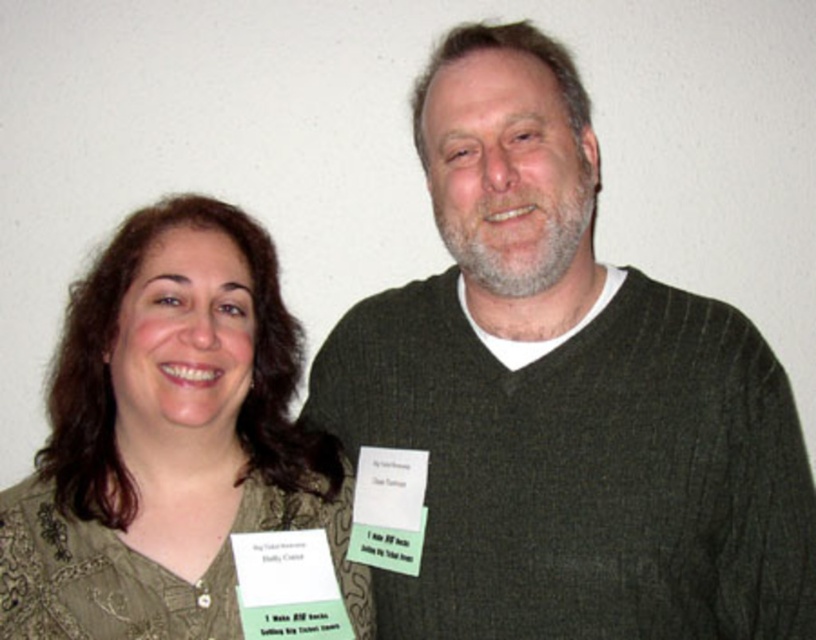
Is dark green sweater at center smaller than green textured blouse at center?

No, dark green sweater at center is not smaller than green textured blouse at center.

The image size is (816, 640). I want to click on dark green sweater at center, so click(565, 396).

The width and height of the screenshot is (816, 640). Describe the element at coordinates (565, 396) in the screenshot. I see `dark green sweater at center` at that location.

Image resolution: width=816 pixels, height=640 pixels. I want to click on dark green sweater at center, so tap(565, 396).